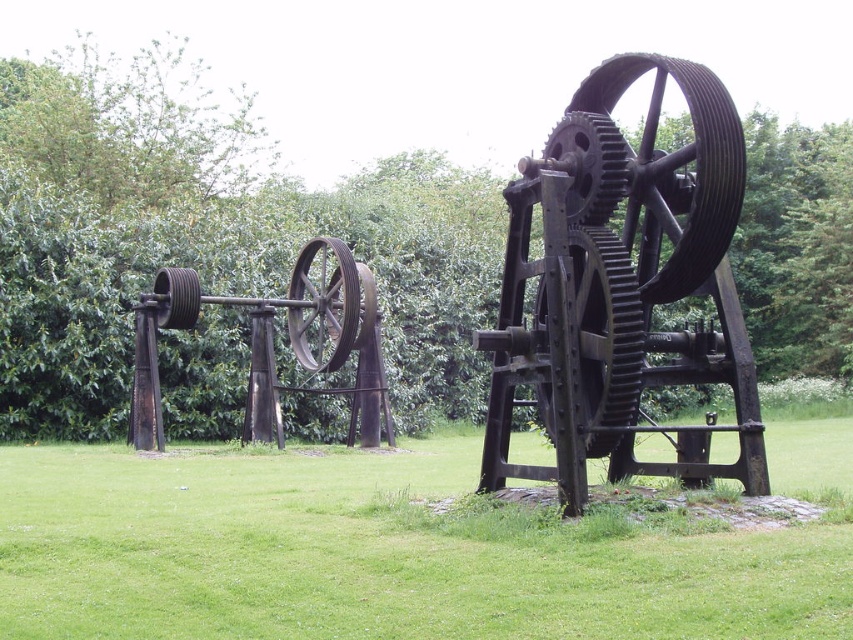
Question: Among these points, which one is farthest from the camera?

Choices:
 (A) (817, 236)
 (B) (183, 324)

Answer: (A)

Question: Which point is farther from the camera taking this photo?

Choices:
 (A) (590, 88)
 (B) (641, 317)
 (C) (368, 317)

Answer: (C)

Question: Considering the relative positions of rustic metal wheel at center and rusty metal gear at center in the image provided, where is rustic metal wheel at center located with respect to rusty metal gear at center?

Choices:
 (A) below
 (B) above

Answer: (A)

Question: Which of the following is the closest to the observer?

Choices:
 (A) green grass at center
 (B) rusty metal wheel at center
 (C) dark brown metal gear at center

Answer: (A)

Question: Is green grass at center to the left of rusty metal wheel at center from the viewer's perspective?

Choices:
 (A) yes
 (B) no

Answer: (B)

Question: Can you confirm if rusty metal wheel at center is positioned to the right of rusty metal gear at center?

Choices:
 (A) no
 (B) yes

Answer: (A)